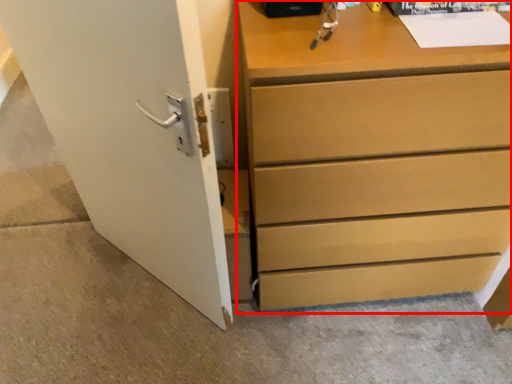
Question: Where is chest of drawers (annotated by the red box) located in relation to door in the image?

Choices:
 (A) right
 (B) left

Answer: (A)